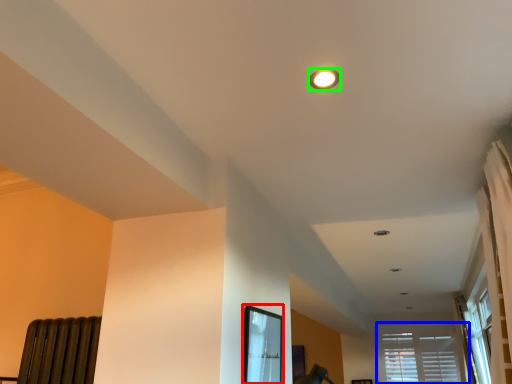
Question: Estimate the real-world distances between objects in this image. Which object is closer to bay window (highlighted by a red box), window (highlighted by a blue box) or lighting (highlighted by a green box)?

Choices:
 (A) window
 (B) lighting

Answer: (B)